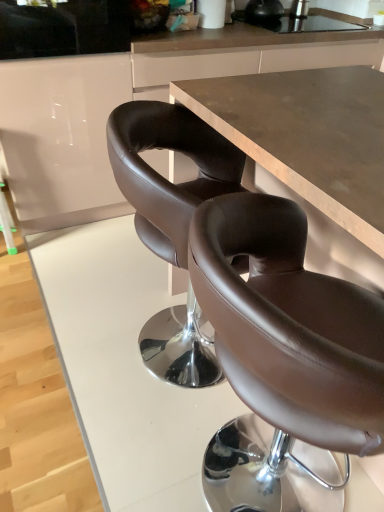
Identify the location of spots to the right of brown leather bar stool at left. Image resolution: width=384 pixels, height=512 pixels. (79, 243).